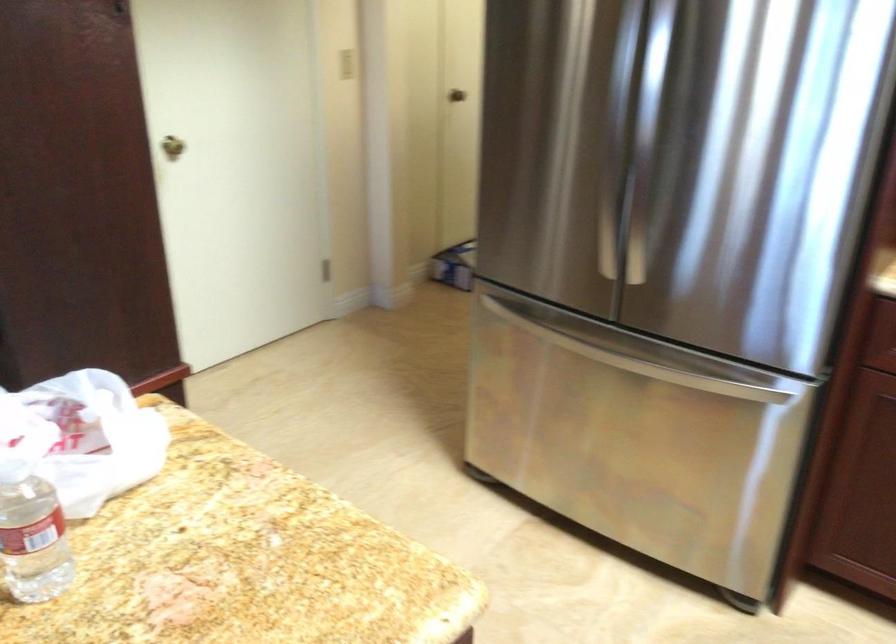
Where would you pull the stainless steel freezer handle? Please return your answer as a coordinate pair (x, y).

(607, 355)